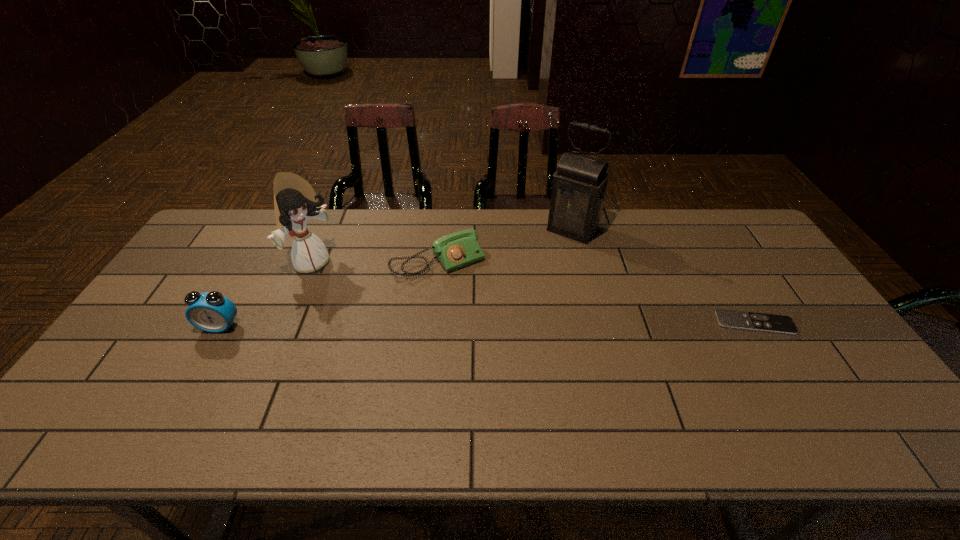
The image size is (960, 540). What are the coordinates of `free spot located on the face of the third shortest object` in the screenshot? It's located at (193, 374).

Find the location of a particular element. This screenshot has width=960, height=540. free space located 0.120m on the left of the remote control is located at coordinates (674, 323).

Where is `vacant space located on the front-facing side of the second object from right to left`? This screenshot has height=540, width=960. vacant space located on the front-facing side of the second object from right to left is located at coordinates (510, 309).

Where is `vacant space located 0.330m on the front-facing side of the second object from right to left`? The width and height of the screenshot is (960, 540). vacant space located 0.330m on the front-facing side of the second object from right to left is located at coordinates (516, 303).

Identify the location of free space located 0.350m on the front-facing side of the second object from right to left. Image resolution: width=960 pixels, height=540 pixels. (512, 307).

Identify the location of free space located on the dial of the telephone. The height and width of the screenshot is (540, 960). (512, 347).

At what (x,y) coordinates should I click in order to perform the action: click on free space located 0.350m on the dial of the telephone. Please return your answer as a coordinate pair (x, y). The image size is (960, 540). Looking at the image, I should click on (521, 361).

Where is `vacant space located 0.240m on the dial of the telephone`? The height and width of the screenshot is (540, 960). vacant space located 0.240m on the dial of the telephone is located at coordinates (499, 332).

This screenshot has height=540, width=960. Find the location of `vacant space located 0.290m at the front face of the fourth object from right to left`. vacant space located 0.290m at the front face of the fourth object from right to left is located at coordinates (396, 315).

Find the location of a particular element. The image size is (960, 540). vacant space located 0.380m at the front face of the fourth object from right to left is located at coordinates (420, 329).